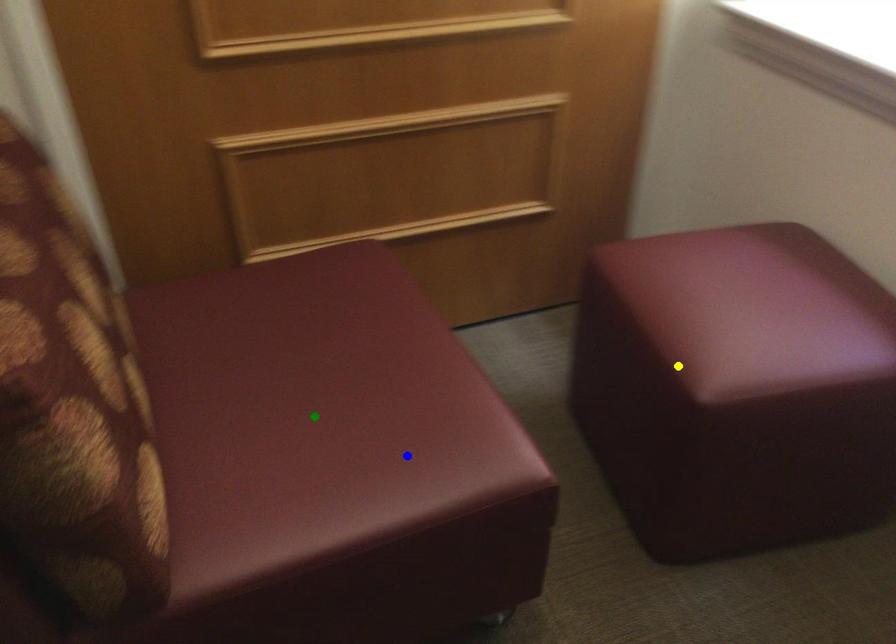
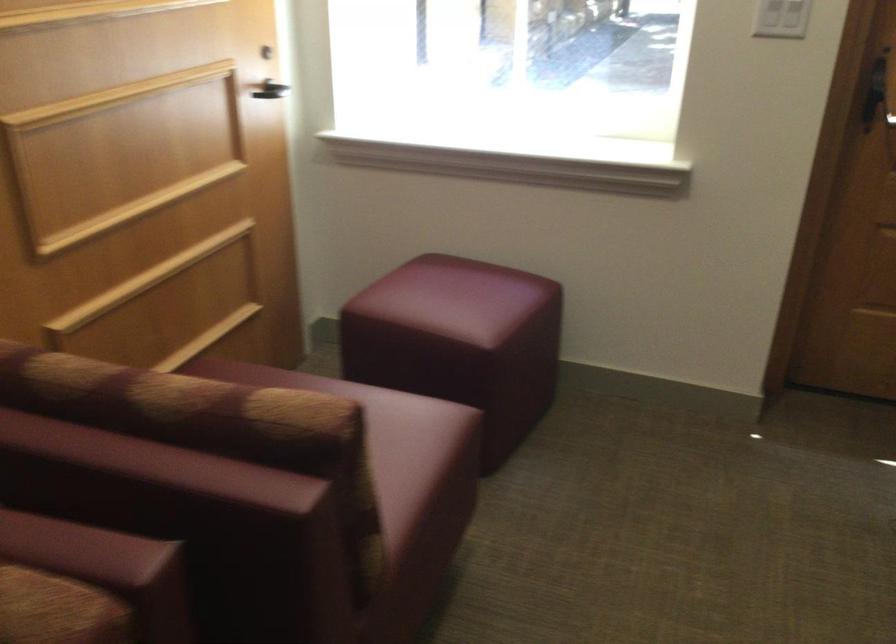
I am providing you with two images of the same scene from different viewpoints. Three points are marked in image1. Which point corresponds to a part or object that is occluded in image2?In image1, three points are marked. Which of them correspond to a part or object that is occluded in image2?Among the three points shown in image1, which one corresponds to a part or object that is no longer visible due to occlusion in image2?

Invisible in image2: green point.